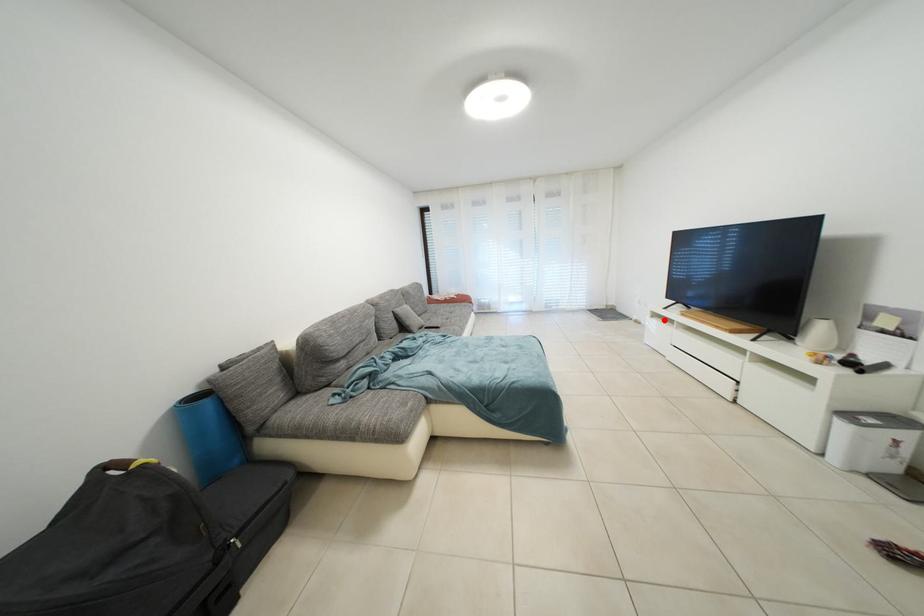
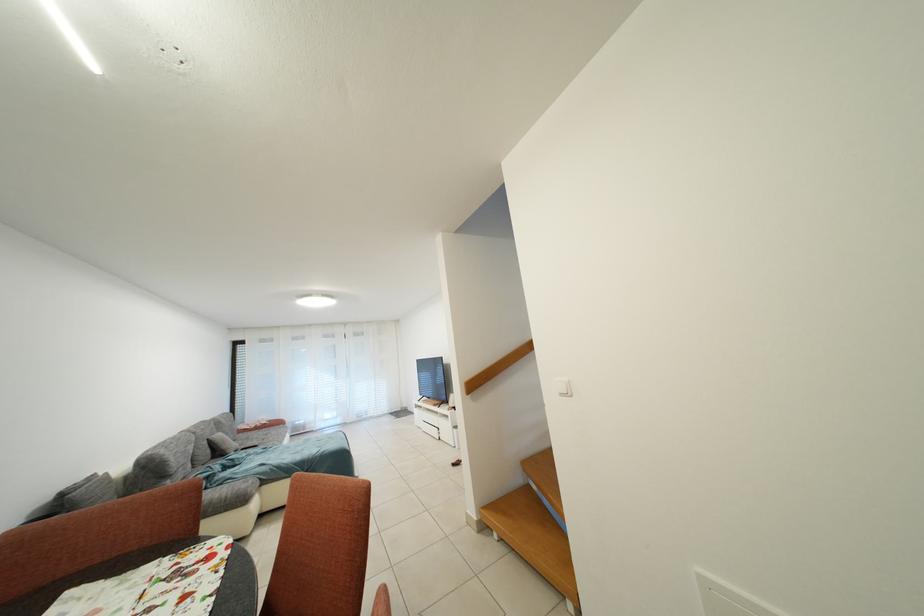
Find the pixel in the second image that matches the highlighted location in the first image.

(426, 410)